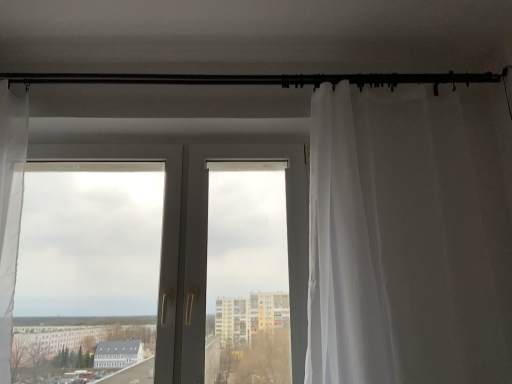
Question: Should I look upward or downward to see sheer white curtain at right?

Choices:
 (A) down
 (B) up

Answer: (A)

Question: Does black metal rod at upper center have a greater height compared to sheer white curtain at right?

Choices:
 (A) no
 (B) yes

Answer: (A)

Question: Are black metal rod at upper center and sheer white curtain at right making contact?

Choices:
 (A) no
 (B) yes

Answer: (A)

Question: Is black metal rod at upper center positioned far away from sheer white curtain at right?

Choices:
 (A) no
 (B) yes

Answer: (A)

Question: From the image's perspective, does black metal rod at upper center appear lower than sheer white curtain at right?

Choices:
 (A) yes
 (B) no

Answer: (B)

Question: Can you confirm if black metal rod at upper center is smaller than sheer white curtain at right?

Choices:
 (A) no
 (B) yes

Answer: (B)

Question: Does black metal rod at upper center contain sheer white curtain at right?

Choices:
 (A) yes
 (B) no

Answer: (B)

Question: From a real-world perspective, is sheer white curtain at right below black metal rod at upper center?

Choices:
 (A) no
 (B) yes

Answer: (B)

Question: From the image's perspective, is sheer white curtain at right on black metal rod at upper center?

Choices:
 (A) yes
 (B) no

Answer: (B)

Question: Is sheer white curtain at right positioned beyond the bounds of black metal rod at upper center?

Choices:
 (A) no
 (B) yes

Answer: (B)

Question: Is sheer white curtain at right not close to black metal rod at upper center?

Choices:
 (A) no
 (B) yes

Answer: (A)

Question: Is sheer white curtain at right next to black metal rod at upper center and touching it?

Choices:
 (A) yes
 (B) no

Answer: (B)

Question: Considering the relative sizes of sheer white curtain at right and black metal rod at upper center in the image provided, is sheer white curtain at right thinner than black metal rod at upper center?

Choices:
 (A) yes
 (B) no

Answer: (B)

Question: Is sheer white curtain at right facing away from white plastic door at center?

Choices:
 (A) no
 (B) yes

Answer: (A)